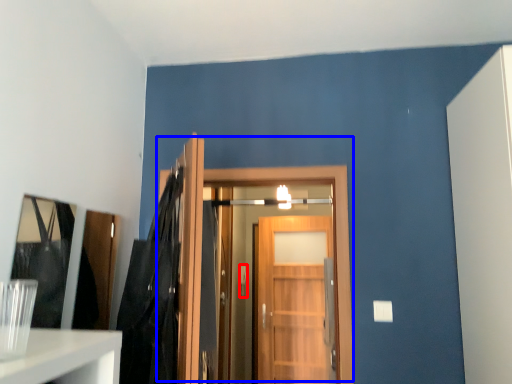
Question: Which point is further to the camera, door handle (highlighted by a red box) or door (highlighted by a blue box)?

Choices:
 (A) door handle
 (B) door

Answer: (A)